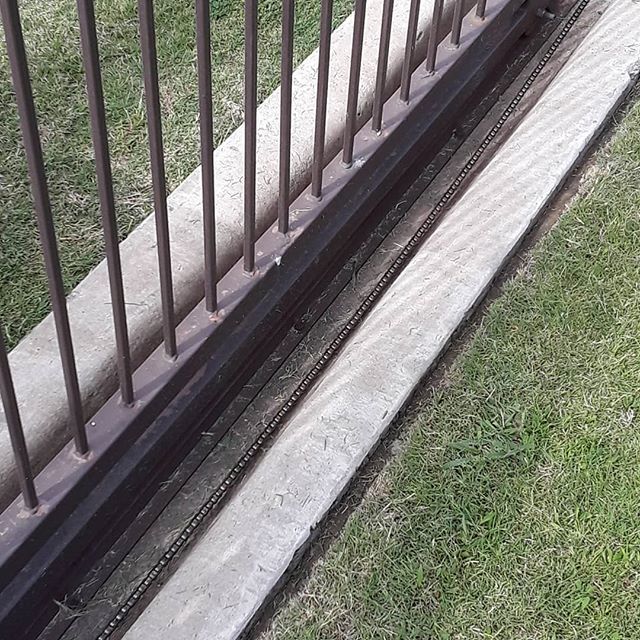
Locate an element on the screen. This screenshot has width=640, height=640. bottom of black rail is located at coordinates (145, 378).